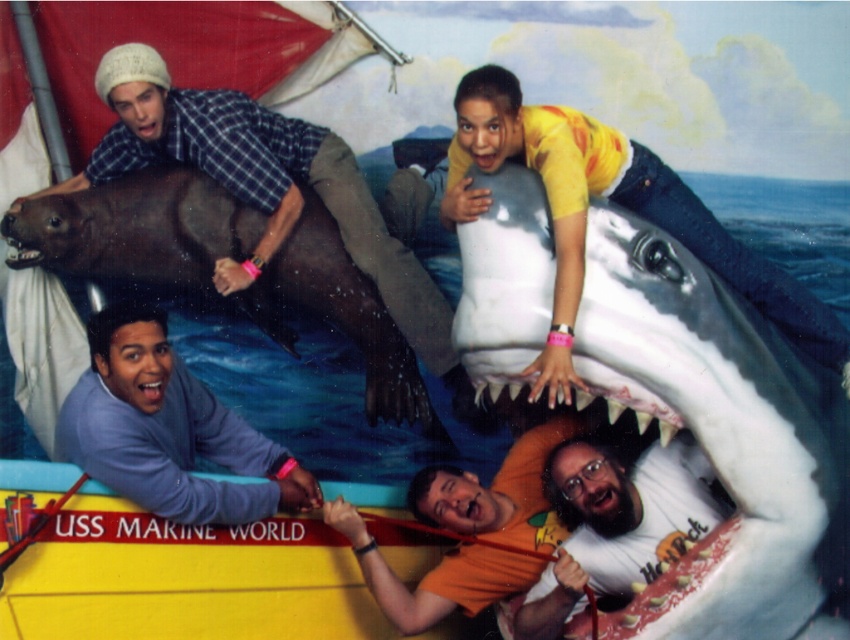
You are a visitor at the marine attraction and want to take a photo of the gray fleece jacket at lower left without the smooth brown seal at upper left blocking the view. Is this possible?

The gray fleece jacket at lower left is behind the smooth brown seal at upper left, so you cannot take a photo of the gray fleece jacket at lower left without the smooth brown seal at upper left blocking the view.

You are a maintenance worker needing to retrieve an item from the gray fleece jacket at lower left. You are currently standing near the smooth brown seal at upper left. Can you reach the jacket without moving more than 1.5 meters?

The smooth brown seal at upper left and gray fleece jacket at lower left are 1.51 meters apart, so you cannot reach the jacket without moving more than 1.5 meters since the distance is slightly over the limit.

You are a visitor at the marine attraction and want to take a photo of the orange matte shirt at lower center without the white glossy shark mouth at upper center appearing in the frame. How can you adjust your position to achieve this?

Move forward closer to the orange matte shirt at lower center so that the white glossy shark mouth at upper center, which is behind the shirt, becomes obscured from view.